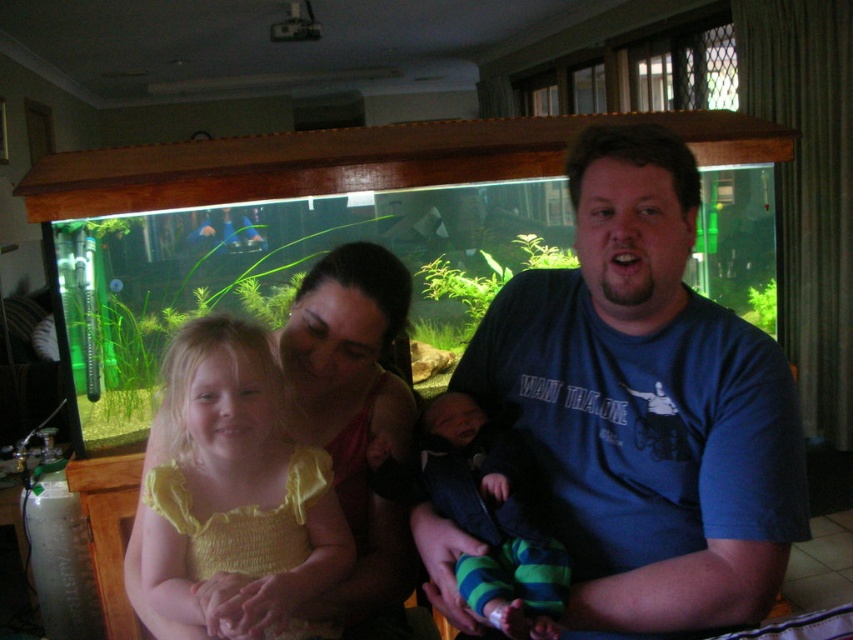
Is yellow fabric dress at center smaller than striped knit pants at center?

No, yellow fabric dress at center is not smaller than striped knit pants at center.

Does point (154, 602) come farther from viewer compared to point (477, 483)?

Yes, point (154, 602) is farther from viewer.

Identify the location of yellow fabric dress at center. This screenshot has width=853, height=640. (236, 490).

You are a GUI agent. You are given a task and a screenshot of the screen. Output one action in this format:
    pyautogui.click(x=<x>, y=<y>)
    Task: Click on the blue cotton shirt at center
    
    Given the screenshot: What is the action you would take?
    pyautogui.click(x=646, y=404)

Consider the image. Measure the distance between blue cotton shirt at center and camera.

A distance of 1.02 meters exists between blue cotton shirt at center and camera.

Is point (688, 333) positioned behind point (473, 502)?

No, (688, 333) is in front of (473, 502).

Locate an element on the screen. blue cotton shirt at center is located at coordinates (646, 404).

Is blue cotton shirt at center smaller than yellow fabric dress at center?

Actually, blue cotton shirt at center might be larger than yellow fabric dress at center.

Can you confirm if blue cotton shirt at center is positioned to the right of yellow fabric dress at center?

Correct, you'll find blue cotton shirt at center to the right of yellow fabric dress at center.

The image size is (853, 640). In order to click on blue cotton shirt at center in this screenshot , I will do `click(646, 404)`.